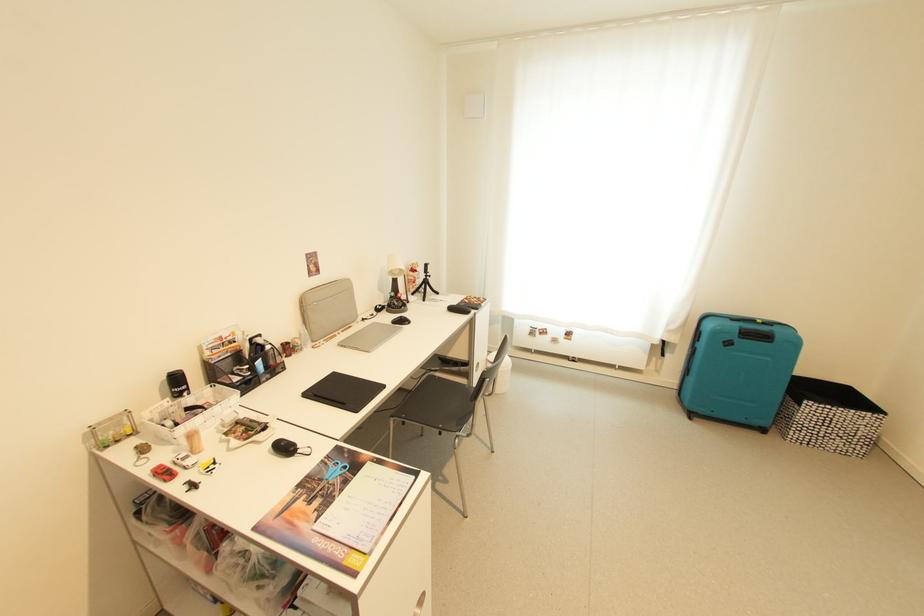
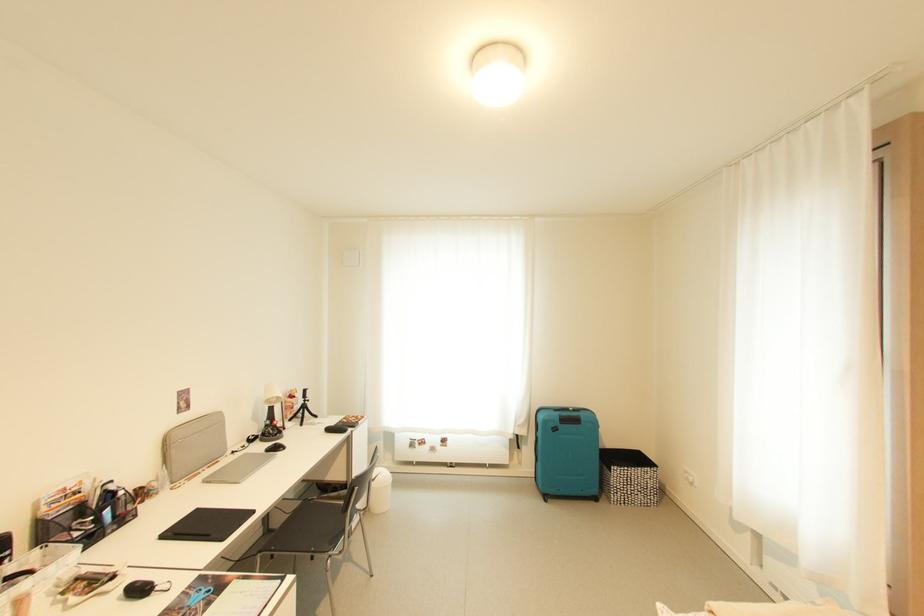
The point at (314, 315) is marked in the first image. Where is the corresponding point in the second image?

(177, 455)